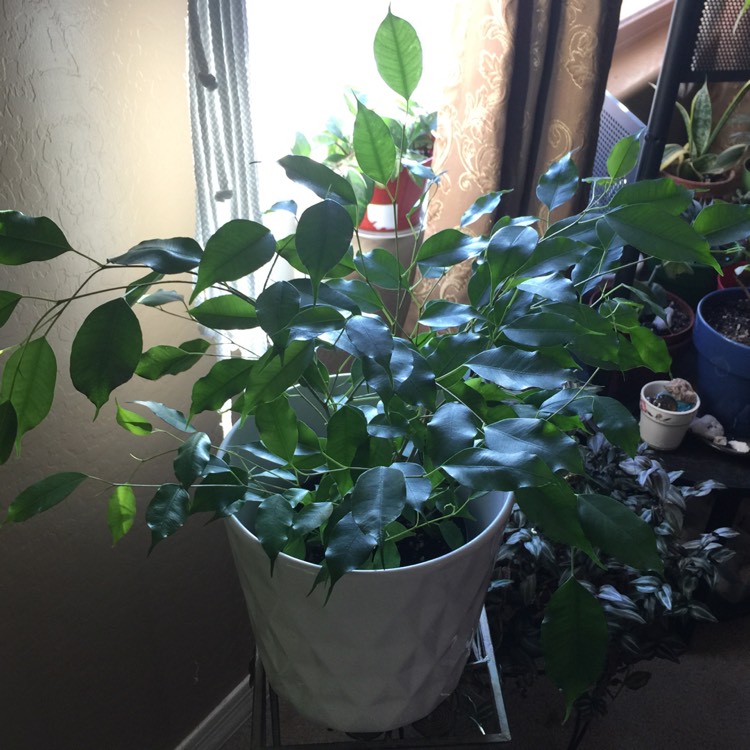
Identify the location of molding. The image size is (750, 750). (241, 711).